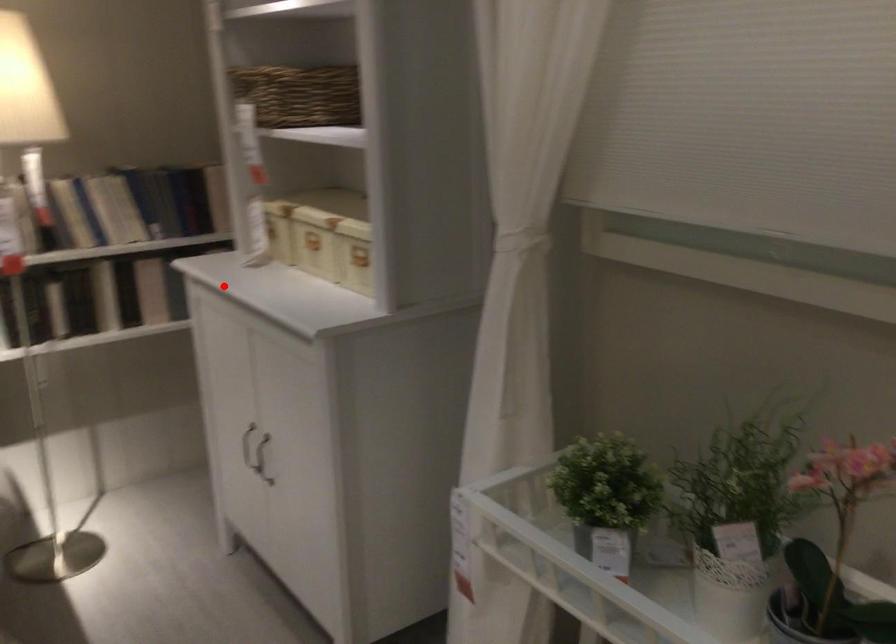
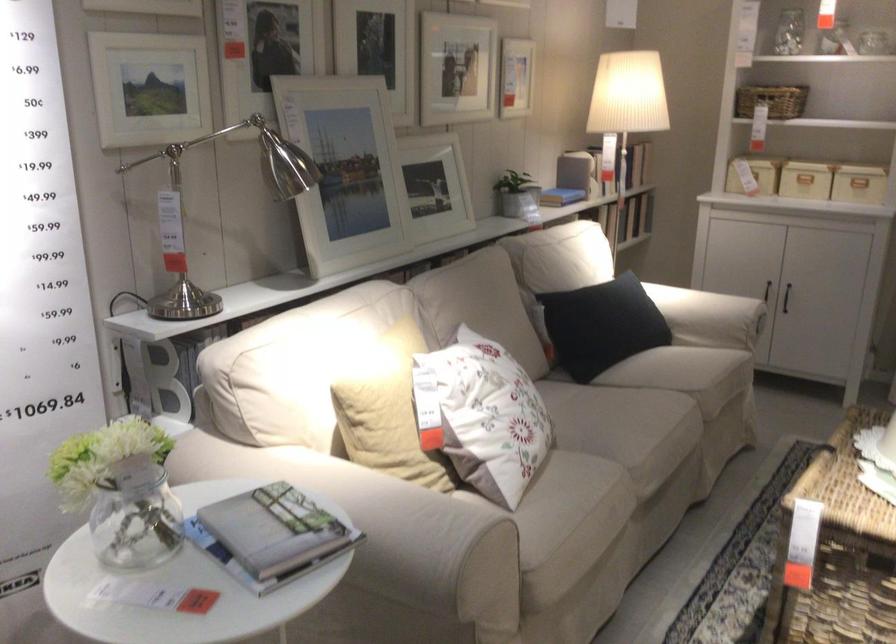
In the second image, find the point that corresponds to the highlighted location in the first image.

(805, 180)